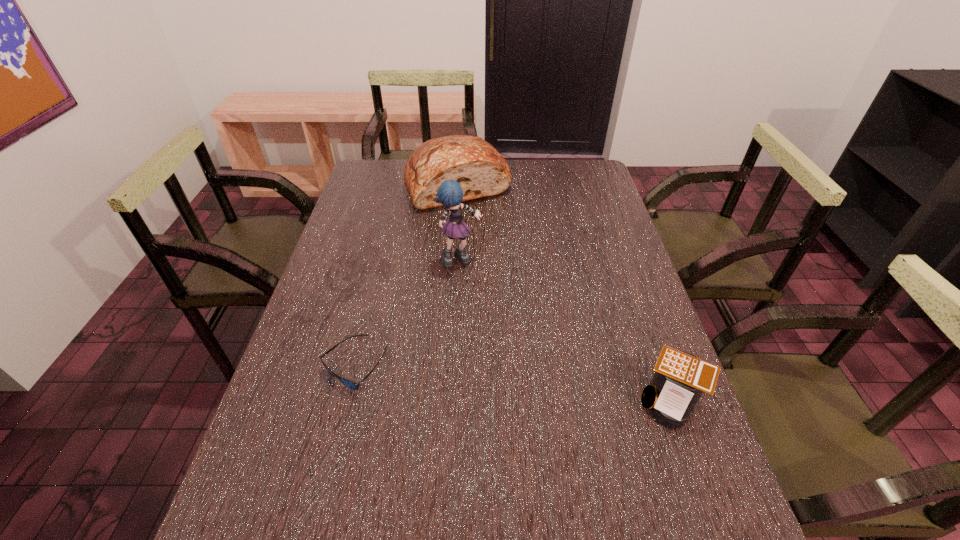
In the image, there is a desktop. Identify the location of vacant space at the right edge. The width and height of the screenshot is (960, 540). (604, 318).

In order to click on vacant space at the far left corner of the desktop in this screenshot , I will do `click(382, 173)`.

This screenshot has width=960, height=540. In the image, there is a desktop. Identify the location of vacant space at the near left corner. (x=267, y=459).

Find the location of a particular element. free space between the sunglasses and the second shortest object is located at coordinates (514, 383).

Where is `free space between the second shortest object and the bread`? The height and width of the screenshot is (540, 960). free space between the second shortest object and the bread is located at coordinates (565, 292).

Identify the location of free space between the shortest object and the tallest object. This screenshot has width=960, height=540. (407, 313).

Image resolution: width=960 pixels, height=540 pixels. I want to click on free area in between the shortest object and the bread, so click(406, 275).

Find the location of a particular element. empty space between the farthest object and the second shortest object is located at coordinates (565, 292).

This screenshot has width=960, height=540. In order to click on blank region between the shortest object and the tallest object in this screenshot , I will do `click(407, 313)`.

At what (x,y) coordinates should I click in order to perform the action: click on vacant space that is in between the third nearest object and the shortest object. Please return your answer as a coordinate pair (x, y). The height and width of the screenshot is (540, 960). Looking at the image, I should click on (407, 313).